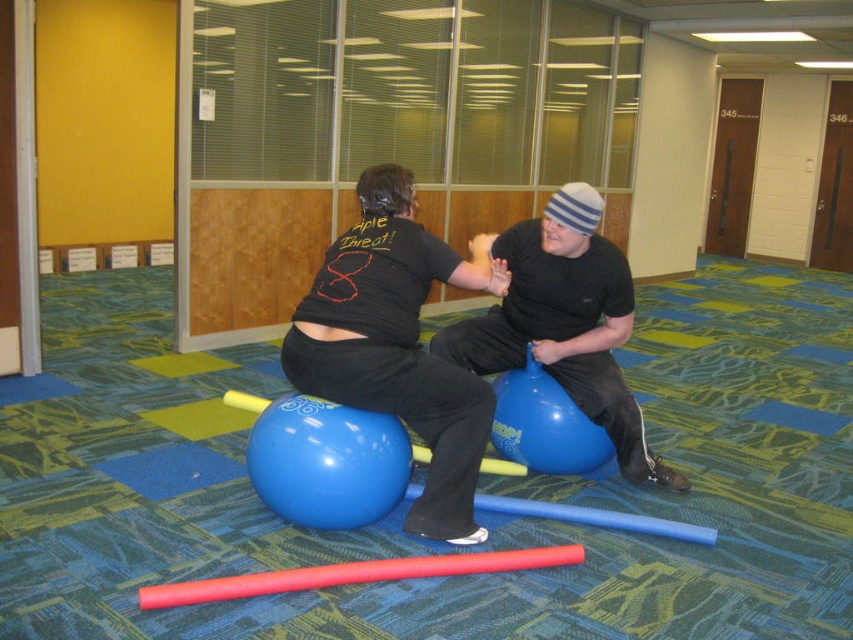
Question: Is the position of shiny blue exercise ball at center less distant than that of blue rubber ball at center?

Choices:
 (A) no
 (B) yes

Answer: (B)

Question: Which object is farther from the camera taking this photo?

Choices:
 (A) blue rubber ball at center
 (B) shiny blue exercise ball at center

Answer: (A)

Question: Which of the following is the farthest from the observer?

Choices:
 (A) blue rubber ball at center
 (B) shiny blue exercise ball at center

Answer: (A)

Question: Considering the relative positions of shiny blue exercise ball at center and blue rubber ball at center in the image provided, where is shiny blue exercise ball at center located with respect to blue rubber ball at center?

Choices:
 (A) right
 (B) left

Answer: (B)

Question: Which point is farther from the camera taking this photo?

Choices:
 (A) (335, 262)
 (B) (577, 381)

Answer: (B)

Question: Can you confirm if shiny blue exercise ball at center is wider than blue rubber ball at center?

Choices:
 (A) no
 (B) yes

Answer: (A)